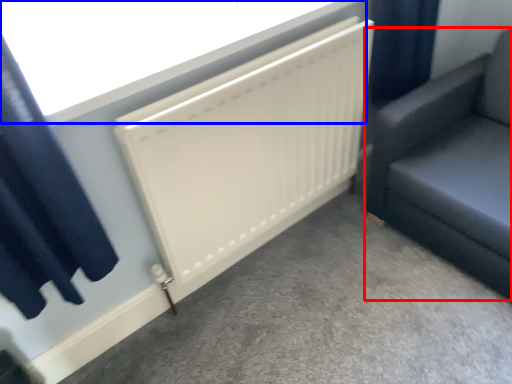
Question: Which object appears closest to the camera in this image, furniture (highlighted by a red box) or window screen (highlighted by a blue box)?

Choices:
 (A) furniture
 (B) window screen

Answer: (B)